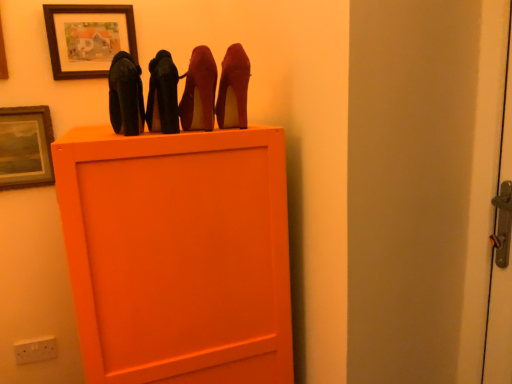
Question: In which direction should I rotate to look at matte wooden picture frame at upper center, the 1th picture frame in the right-to-left sequence?

Choices:
 (A) left
 (B) right

Answer: (A)

Question: In which direction should I rotate to look at shiny black high heels at center, acting as the third high heels starting from the right?

Choices:
 (A) left
 (B) right

Answer: (A)

Question: Considering the relative sizes of matte wooden picture frame at upper center, which is the second picture frame in bottom-to-top order, and wooden picture frame at upper left, the 1th picture frame in the bottom-to-top sequence, in the image provided, is matte wooden picture frame at upper center, which is the second picture frame in bottom-to-top order, shorter than wooden picture frame at upper left, the 1th picture frame in the bottom-to-top sequence,?

Choices:
 (A) no
 (B) yes

Answer: (B)

Question: Considering the relative positions of matte wooden picture frame at upper center, the 1th picture frame in the right-to-left sequence, and wooden picture frame at upper left, the 1th picture frame in the bottom-to-top sequence, in the image provided, is matte wooden picture frame at upper center, the 1th picture frame in the right-to-left sequence, to the right of wooden picture frame at upper left, the 1th picture frame in the bottom-to-top sequence, from the viewer's perspective?

Choices:
 (A) yes
 (B) no

Answer: (A)

Question: Can you confirm if matte wooden picture frame at upper center, which is counted as the 2th picture frame, starting from the left, is positioned to the left of wooden picture frame at upper left, the first picture frame from the left?

Choices:
 (A) yes
 (B) no

Answer: (B)

Question: From a real-world perspective, is matte wooden picture frame at upper center, the 1th picture frame in the right-to-left sequence, positioned over wooden picture frame at upper left, the second picture frame viewed from the top, based on gravity?

Choices:
 (A) yes
 (B) no

Answer: (A)

Question: Can you confirm if matte wooden picture frame at upper center, the 1th picture frame in the right-to-left sequence, is taller than wooden picture frame at upper left, the second picture frame viewed from the top?

Choices:
 (A) yes
 (B) no

Answer: (B)

Question: From a real-world perspective, is matte wooden picture frame at upper center, the 1th picture frame in the right-to-left sequence, beneath wooden picture frame at upper left, the second picture frame viewed from the top?

Choices:
 (A) no
 (B) yes

Answer: (A)

Question: Are wooden picture frame at upper left, the first picture frame from the left, and white plastic electric outlet at lower left located far from each other?

Choices:
 (A) no
 (B) yes

Answer: (A)

Question: From a real-world perspective, does wooden picture frame at upper left, which is the second picture frame from right to left, sit lower than white plastic electric outlet at lower left?

Choices:
 (A) no
 (B) yes

Answer: (A)

Question: Is wooden picture frame at upper left, the second picture frame viewed from the top, next to white plastic electric outlet at lower left and touching it?

Choices:
 (A) yes
 (B) no

Answer: (B)

Question: Can you confirm if wooden picture frame at upper left, the 1th picture frame in the bottom-to-top sequence, is positioned to the left of white plastic electric outlet at lower left?

Choices:
 (A) no
 (B) yes

Answer: (B)

Question: Can you confirm if wooden picture frame at upper left, the second picture frame viewed from the top, is smaller than white plastic electric outlet at lower left?

Choices:
 (A) yes
 (B) no

Answer: (B)

Question: From the image's perspective, does wooden picture frame at upper left, the second picture frame viewed from the top, appear higher than white plastic electric outlet at lower left?

Choices:
 (A) no
 (B) yes

Answer: (B)

Question: Is white plastic electric outlet at lower left closer to camera compared to wooden picture frame at upper left, the second picture frame viewed from the top?

Choices:
 (A) no
 (B) yes

Answer: (A)